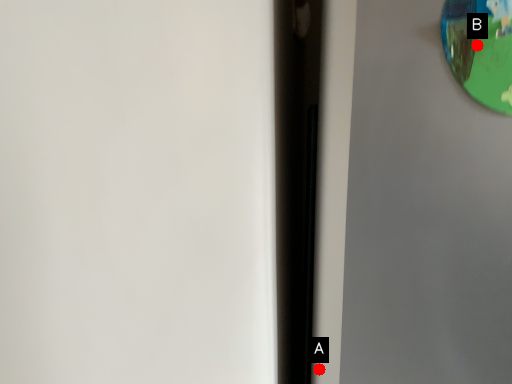
Question: Two points are circled on the image, labeled by A and B beside each circle. Which point is further to the camera?

Choices:
 (A) A is further
 (B) B is further

Answer: (A)